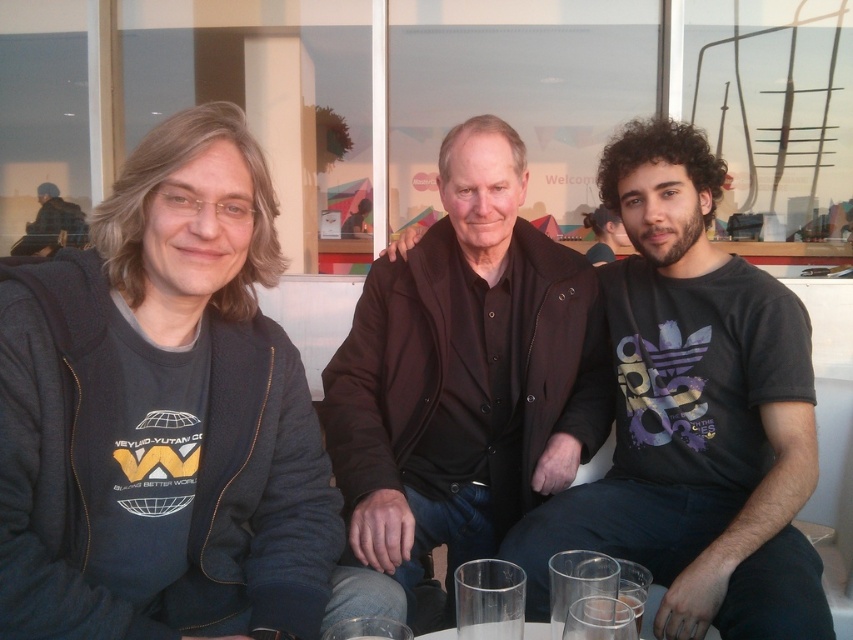
You are a photographer standing in front of the scene. You need to capture a photo of the dark blue uniform at left and the transparent glass at lower center. According to the spatial arrangement, which object is positioned higher?

The dark blue uniform at left is above the transparent glass at lower center, so it is positioned higher.